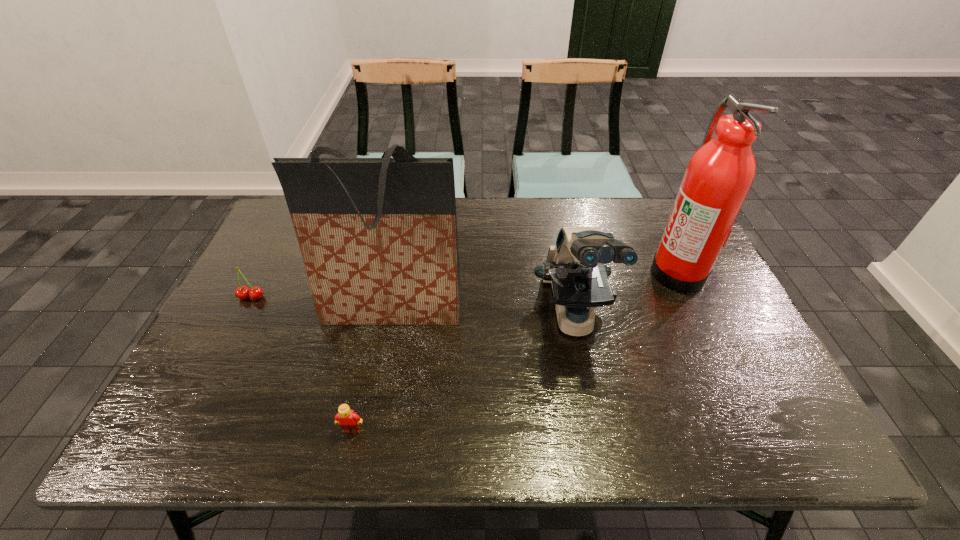
The height and width of the screenshot is (540, 960). What are the coordinates of `free space between the third shortest object and the rightmost object` in the screenshot? It's located at (625, 294).

Where is `vacant space that's between the third tallest object and the Lego`? vacant space that's between the third tallest object and the Lego is located at coordinates (463, 373).

You are a GUI agent. You are given a task and a screenshot of the screen. Output one action in this format:
    pyautogui.click(x=<x>, y=<y>)
    Task: Click on the vacant space that's between the fire extinguisher and the shopping bag
    Image resolution: width=960 pixels, height=540 pixels.
    Given the screenshot: What is the action you would take?
    point(535,290)

I want to click on empty space that is in between the microscope and the shopping bag, so click(483, 313).

Identify the location of vacant area between the shopping bag and the nearest object. This screenshot has width=960, height=540. (372, 369).

You are a GUI agent. You are given a task and a screenshot of the screen. Output one action in this format:
    pyautogui.click(x=<x>, y=<y>)
    Task: Click on the vacant point located between the fire extinguisher and the second object from right to left
    Image resolution: width=960 pixels, height=540 pixels.
    Given the screenshot: What is the action you would take?
    pyautogui.click(x=625, y=294)

The height and width of the screenshot is (540, 960). In order to click on empty location between the shopping bag and the microscope in this screenshot , I will do `click(483, 313)`.

This screenshot has width=960, height=540. I want to click on object that is the fourth closest to the nearest object, so click(719, 175).

Point out which object is positioned as the nearest to the fire extinguisher. Please provide its 2D coordinates. Your answer should be formatted as a tuple, i.e. [(x, y)], where the tuple contains the x and y coordinates of a point satisfying the conditions above.

[(575, 266)]

You are a GUI agent. You are given a task and a screenshot of the screen. Output one action in this format:
    pyautogui.click(x=<x>, y=<y>)
    Task: Click on the vacant position in the image that satisfies the following two spatial constraints: 1. on the label side of the rightmost object; 2. on the front-facing side of the shopping bag
    This screenshot has width=960, height=540.
    Given the screenshot: What is the action you would take?
    pyautogui.click(x=695, y=308)